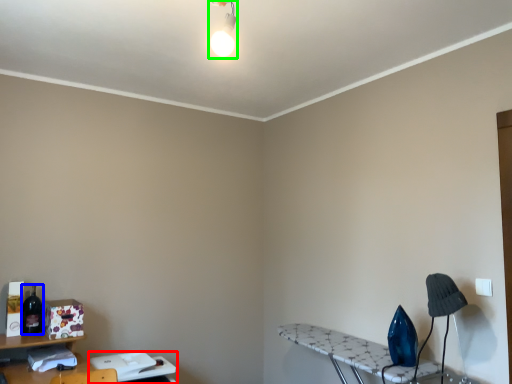
Question: Based on their relative distances, which object is nearer to table (highlighted by a red box)? Choose from bottle (highlighted by a blue box) and light fixture (highlighted by a green box).

Choices:
 (A) bottle
 (B) light fixture

Answer: (A)